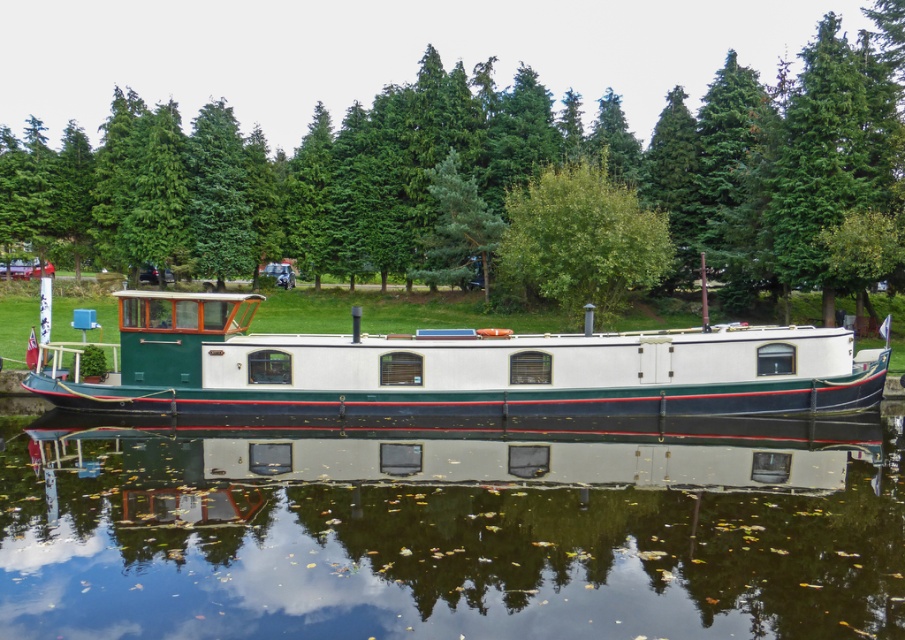
Question: Estimate the real-world distances between objects in this image. Which object is farther from the green textured tree at upper center?

Choices:
 (A) white glossy houseboat at center
 (B) green leafy tree at center
 (C) transparent glass water at center

Answer: (C)

Question: Does transparent glass water at center have a larger size compared to green leafy tree at center?

Choices:
 (A) yes
 (B) no

Answer: (B)

Question: Is the position of transparent glass water at center less distant than that of green leafy tree at center?

Choices:
 (A) no
 (B) yes

Answer: (B)

Question: Which is nearer to the green leafy tree at center?

Choices:
 (A) green textured tree at upper center
 (B) transparent glass water at center
 (C) white glossy houseboat at center

Answer: (C)

Question: Does green textured tree at upper center appear under green leafy tree at center?

Choices:
 (A) no
 (B) yes

Answer: (A)

Question: Which point is farther to the camera?

Choices:
 (A) (367, 365)
 (B) (811, 84)

Answer: (B)